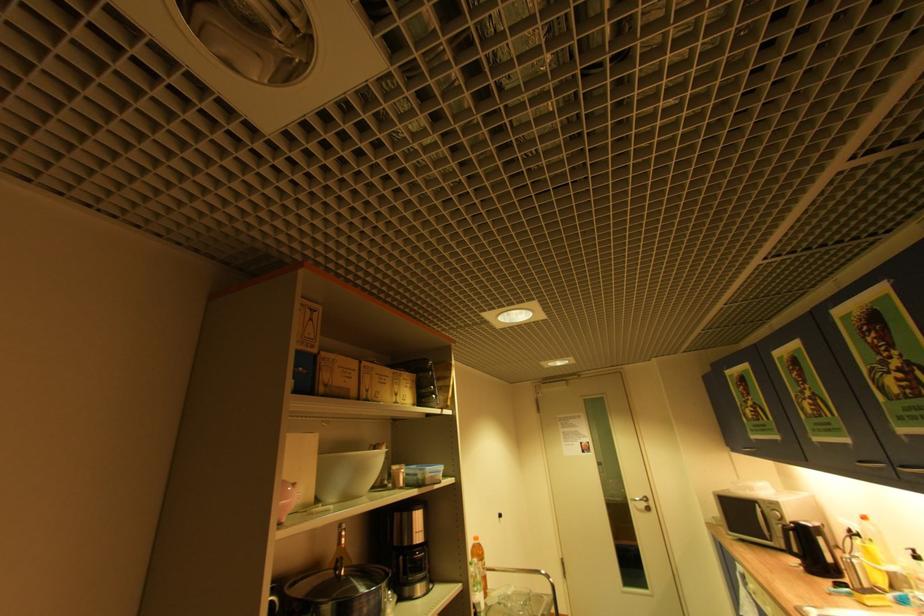
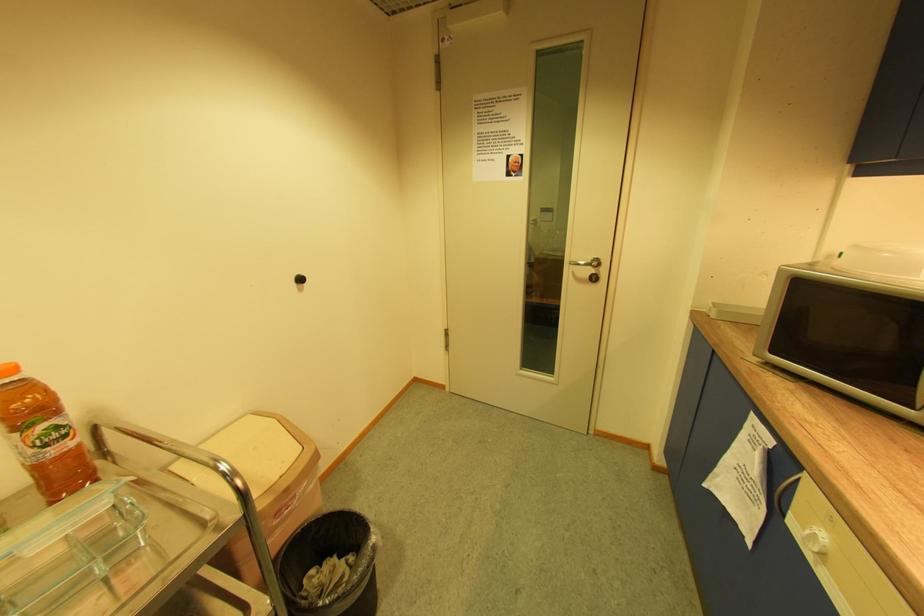
Locate, in the second image, the point that corresponds to (x=650, y=505) in the first image.

(598, 272)